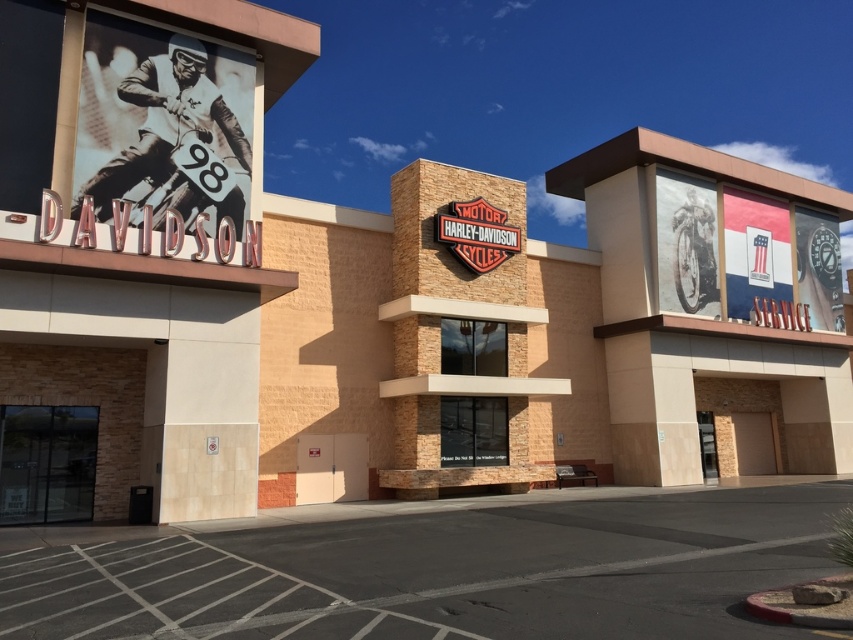
Which is in front, point (672, 596) or point (10, 481)?

Point (672, 596) is more forward.

Can you confirm if gray asphalt at lower center is shorter than transparent glass door at lower left?

Yes, gray asphalt at lower center is shorter than transparent glass door at lower left.

The width and height of the screenshot is (853, 640). Identify the location of gray asphalt at lower center. (439, 573).

Is matte beige sign at upper left positioned behind gray asphalt at lower center?

Yes.

In the scene shown: Who is more forward, (106, 115) or (743, 596)?

Point (743, 596) is more forward.

Identify the location of matte beige sign at upper left. This screenshot has width=853, height=640. (135, 250).

The height and width of the screenshot is (640, 853). Describe the element at coordinates (135, 250) in the screenshot. I see `matte beige sign at upper left` at that location.

Who is more forward, (80, 44) or (35, 454)?

Point (80, 44)

Locate an element on the screen. matte beige sign at upper left is located at coordinates (135, 250).